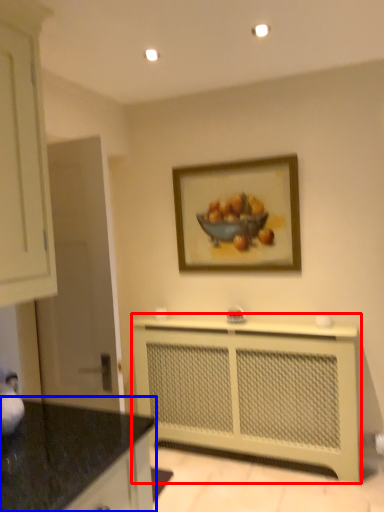
Question: Which of the following is the closest to the observer, counter (highlighted by a red box) or countertop (highlighted by a blue box)?

Choices:
 (A) counter
 (B) countertop

Answer: (B)